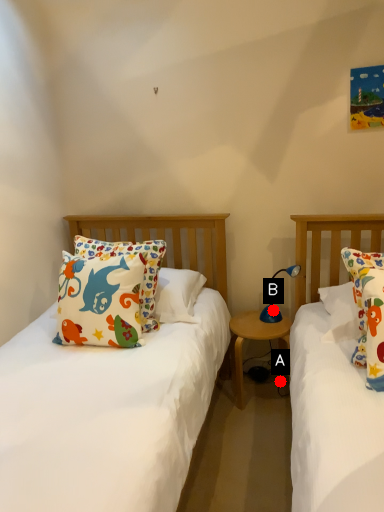
Question: Two points are circled on the image, labeled by A and B beside each circle. Which of the following is the farthest from the observer?

Choices:
 (A) A is further
 (B) B is further

Answer: (A)